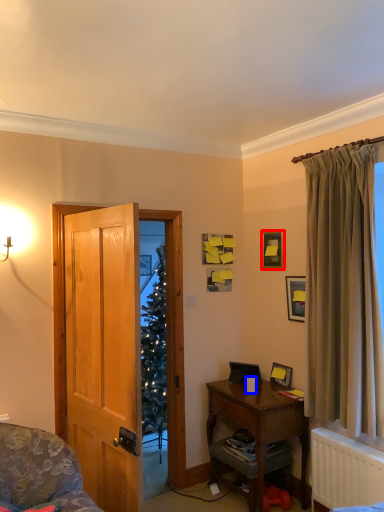
Question: Which object is closer to the camera taking this photo, picture frame (highlighted by a red box) or coffee cup (highlighted by a blue box)?

Choices:
 (A) picture frame
 (B) coffee cup

Answer: (B)